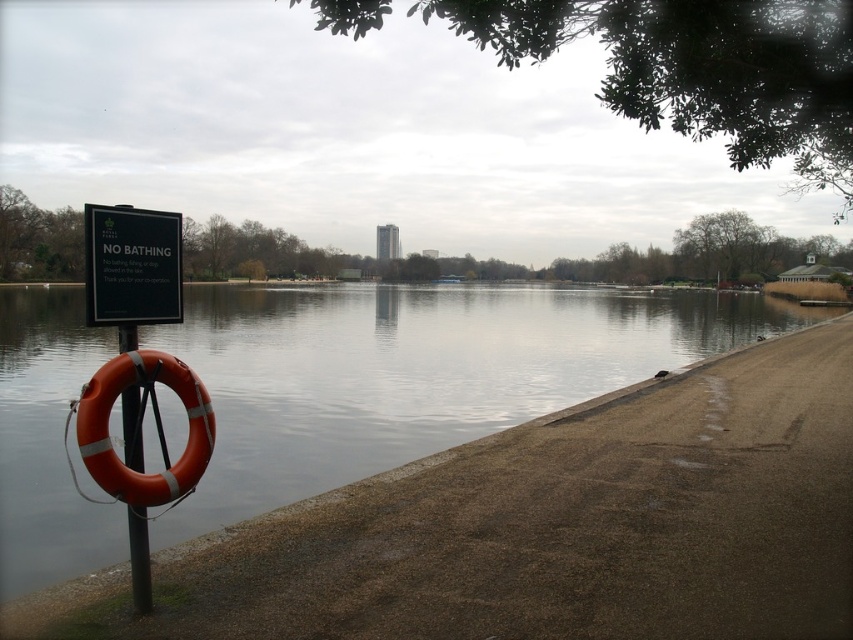
You are standing at point (102, 205) and want to walk to point (370, 387). Which direction should you move relative to the path?

Since point (370, 387) is behind point (102, 205) relative to the path, you should move in the direction away from the water to reach it.

In the scene shown: You are a hiker who wants to cross the smooth concrete river at lower left to reach the orange rubber life jacket at left. Is the path wide enough for you to walk on safely?

The smooth concrete river at lower left is bigger than orange rubber life jacket at left, so the path is wide enough for you to walk on safely.